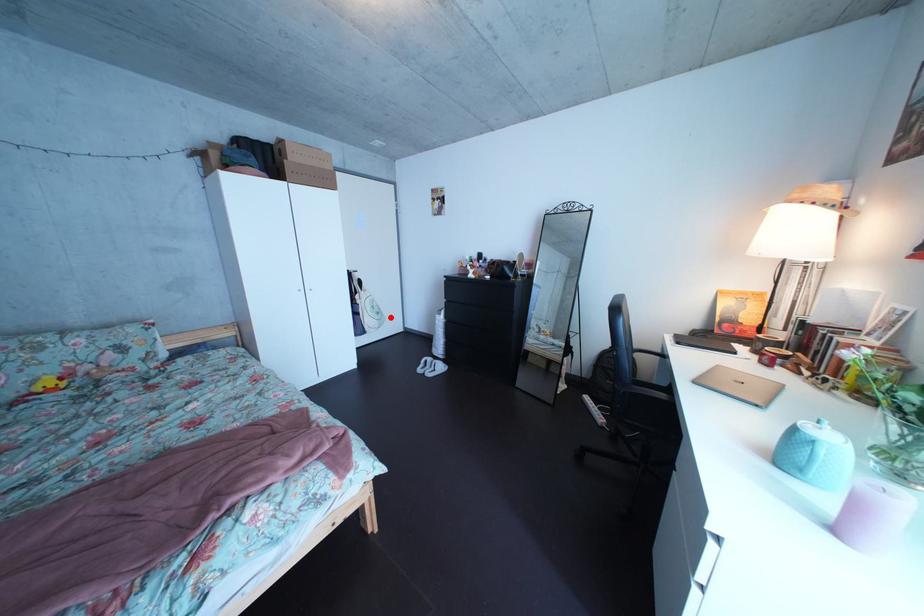
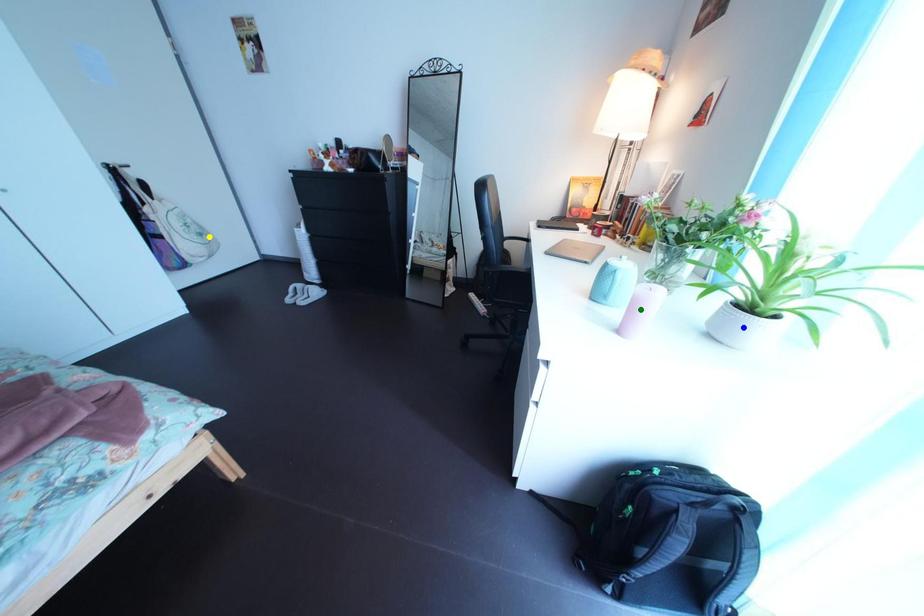
Question: I am providing you with two images of the same scene from different viewpoints. A red point is marked on the first image. You are given multiple points on the second image. Which point in image 2 is actually the same real-world point as the red point in image 1?

Choices:
 (A) green point
 (B) yellow point
 (C) blue point

Answer: (B)